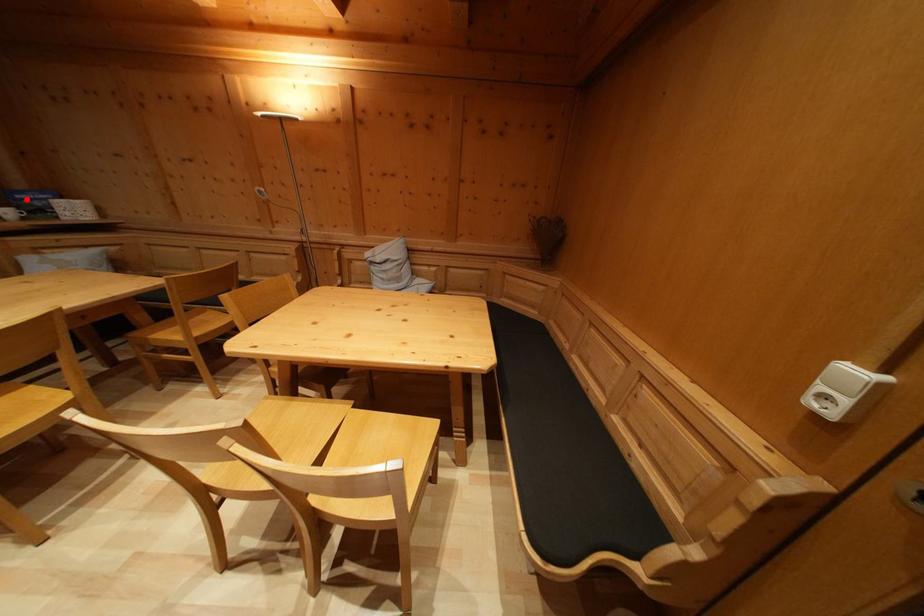
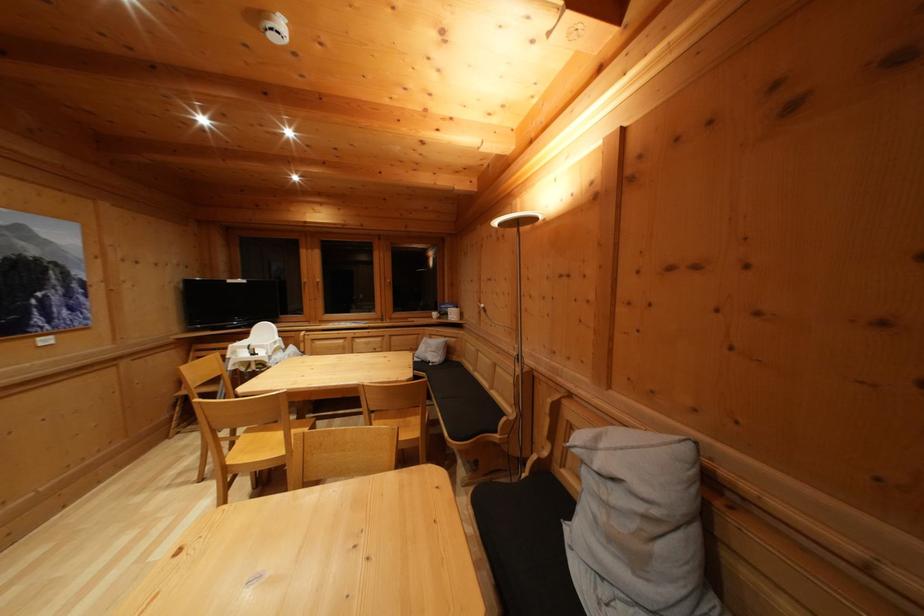
Question: I am providing you with two images of the same scene from different viewpoints. Image1 has a red point marked. In image2, the corresponding 3D location appears at what relative position? Reply with the corresponding letter.

Choices:
 (A) Closer
 (B) Farther

Answer: (A)